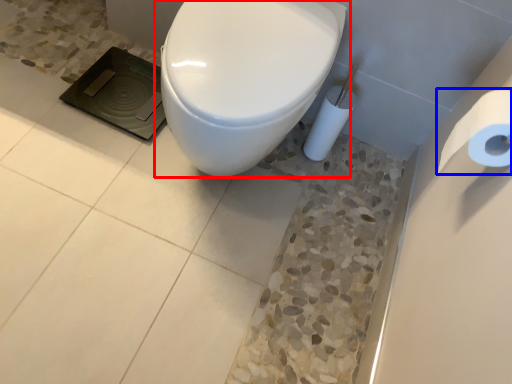
Question: Which object appears farthest to the camera in this image, toilet (highlighted by a red box) or toilet paper (highlighted by a blue box)?

Choices:
 (A) toilet
 (B) toilet paper

Answer: (A)